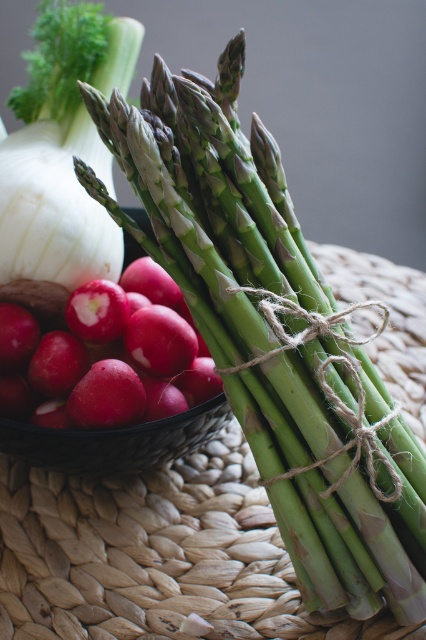
Question: Among these objects, which one is nearest to the camera?

Choices:
 (A) white smooth onion at upper left
 (B) smooth red radish at lower left

Answer: (B)

Question: Observing the image, what is the correct spatial positioning of smooth red radish at lower left in reference to white smooth onion at upper left?

Choices:
 (A) below
 (B) above

Answer: (A)

Question: Does smooth red radish at lower left have a larger size compared to white smooth onion at upper left?

Choices:
 (A) yes
 (B) no

Answer: (A)

Question: Considering the relative positions of smooth red radish at lower left and white smooth onion at upper left in the image provided, where is smooth red radish at lower left located with respect to white smooth onion at upper left?

Choices:
 (A) right
 (B) left

Answer: (A)

Question: Which object is farther from the camera taking this photo?

Choices:
 (A) white smooth onion at upper left
 (B) smooth red radish at lower left

Answer: (A)